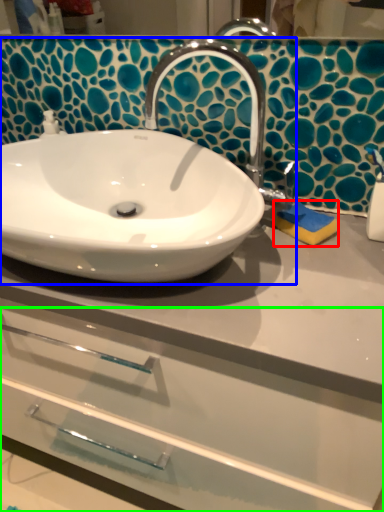
Question: Which is nearer to the soap (highlighted by a red box)? sink (highlighted by a blue box) or drawer (highlighted by a green box).

Choices:
 (A) sink
 (B) drawer

Answer: (A)